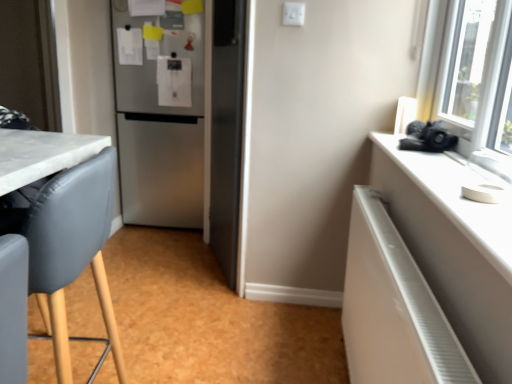
Question: From a real-world perspective, is satin silver refrigerator at center physically located above or below white glossy radiator at right?

Choices:
 (A) below
 (B) above

Answer: (B)

Question: Is satin silver refrigerator at center spatially inside white glossy radiator at right, or outside of it?

Choices:
 (A) outside
 (B) inside

Answer: (A)

Question: Which of these objects is positioned farthest from the satin silver refrigerator at center?

Choices:
 (A) white glossy radiator at right
 (B) matte gray chair at left

Answer: (A)

Question: Which object is positioned closest to the satin silver refrigerator at center?

Choices:
 (A) white glossy radiator at right
 (B) matte gray chair at left

Answer: (B)